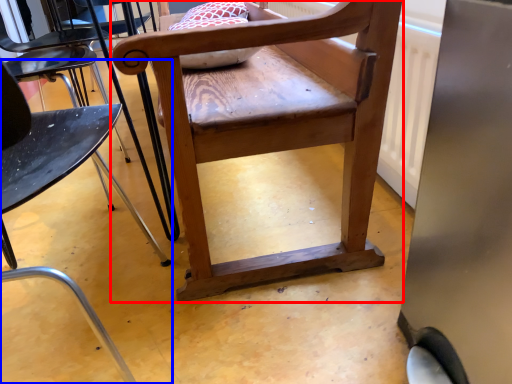
Question: Among these objects, which one is nearest to the camera, chair (highlighted by a red box) or chair (highlighted by a blue box)?

Choices:
 (A) chair
 (B) chair

Answer: (B)